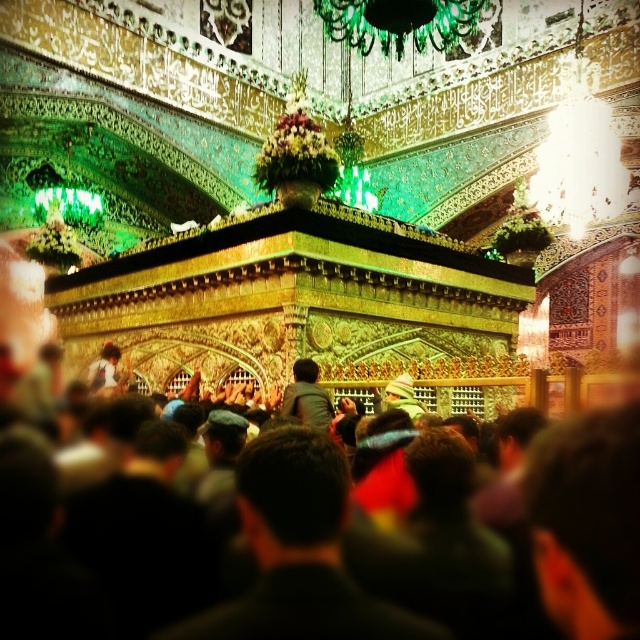
You are standing in the center of the mosque and want to place a small prayer mat. The black fabric at center is currently occupying the spot at coordinates 0.812, 0.908. Can you place your prayer mat there?

The black fabric at center is located at point (580, 518), so you cannot place your prayer mat there as it is already occupied by the black fabric at center.